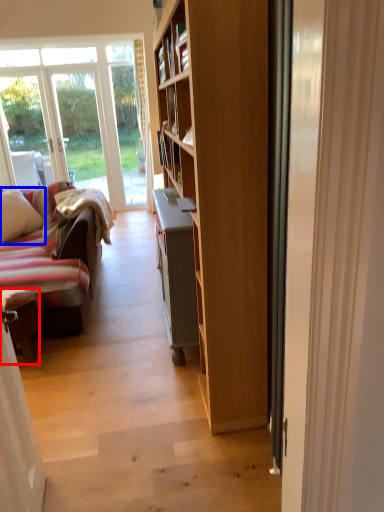
Question: Which object is further to the camera taking this photo, chair (highlighted by a red box) or pillow (highlighted by a blue box)?

Choices:
 (A) chair
 (B) pillow

Answer: (B)